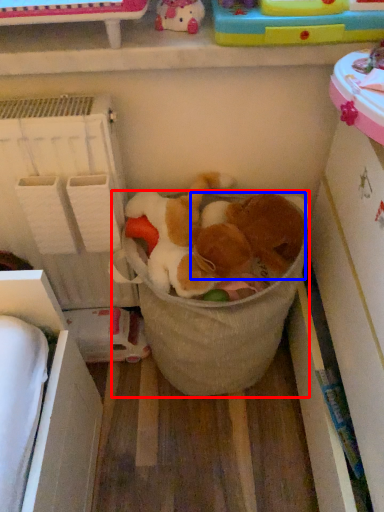
Question: Which object is further to the camera taking this photo, laundry basket (highlighted by a red box) or animal (highlighted by a blue box)?

Choices:
 (A) laundry basket
 (B) animal

Answer: (A)